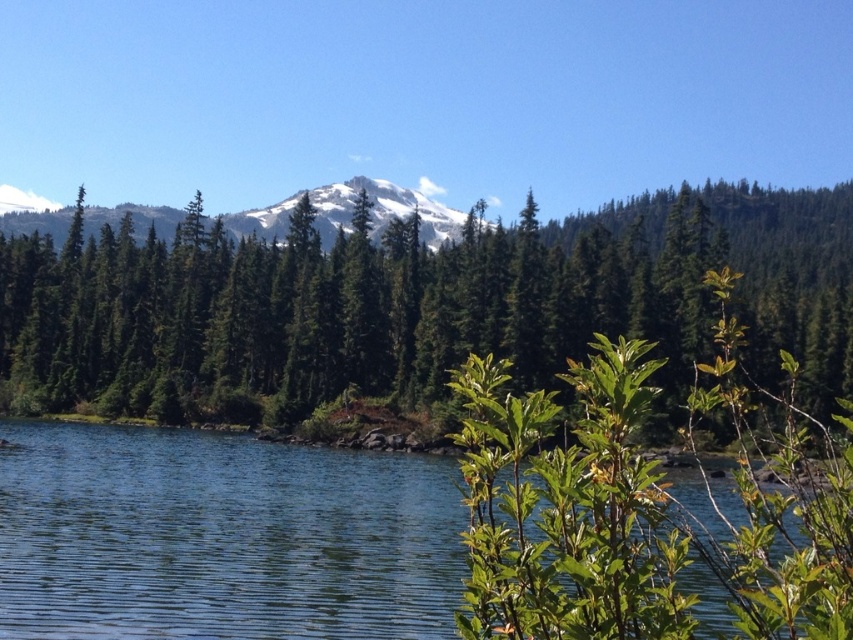
You are standing at the lakeside and want to take a photo that includes both the clear blue water at center and the snowy white mountain at center. Which object will appear smaller in the photo?

The clear blue water at center will appear smaller in the photo because it is shorter than the snowy white mountain at center.